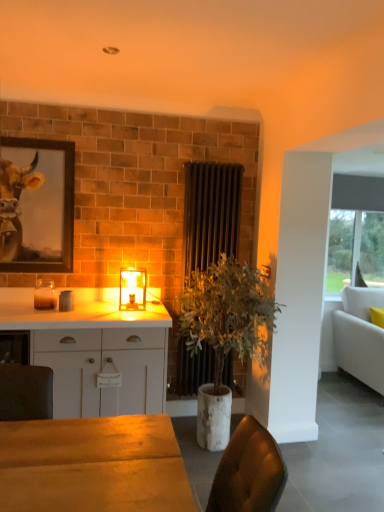
The image size is (384, 512). I want to click on free space in front of translucent glass lamp at center, so click(135, 314).